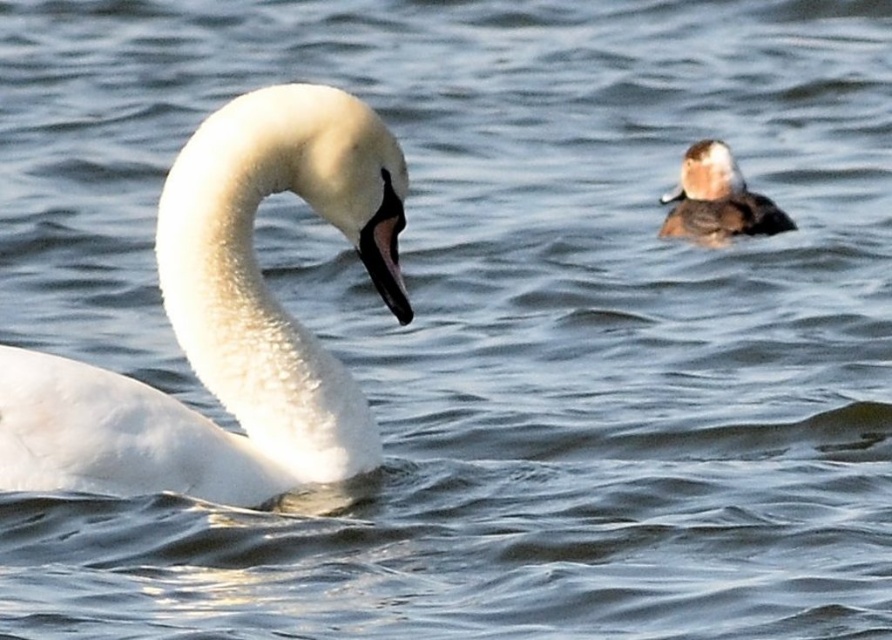
Based on the photo, does white matte swan at left have a smaller size compared to black glossy beak at center?

Incorrect, white matte swan at left is not smaller in size than black glossy beak at center.

Between point (345, 168) and point (390, 257), which one is positioned in front?

Point (345, 168)

Does point (321, 452) come in front of point (377, 250)?

No.

Image resolution: width=892 pixels, height=640 pixels. In order to click on white matte swan at left in this screenshot , I will do `click(219, 324)`.

Which is in front, point (713, 168) or point (387, 200)?

Positioned in front is point (387, 200).

Between brown speckled duck at upper right and black glossy beak at center, which one is positioned lower?

Positioned lower is black glossy beak at center.

What are the coordinates of `brown speckled duck at upper right` in the screenshot? It's located at (717, 198).

Can you confirm if white matte swan at left is positioned above brown speckled duck at upper right?

Actually, white matte swan at left is below brown speckled duck at upper right.

Consider the image. Is white matte swan at left further to camera compared to brown speckled duck at upper right?

No, white matte swan at left is closer to the viewer.

Image resolution: width=892 pixels, height=640 pixels. What do you see at coordinates (219, 324) in the screenshot? I see `white matte swan at left` at bounding box center [219, 324].

This screenshot has width=892, height=640. Find the location of `white matte swan at left`. white matte swan at left is located at coordinates (219, 324).